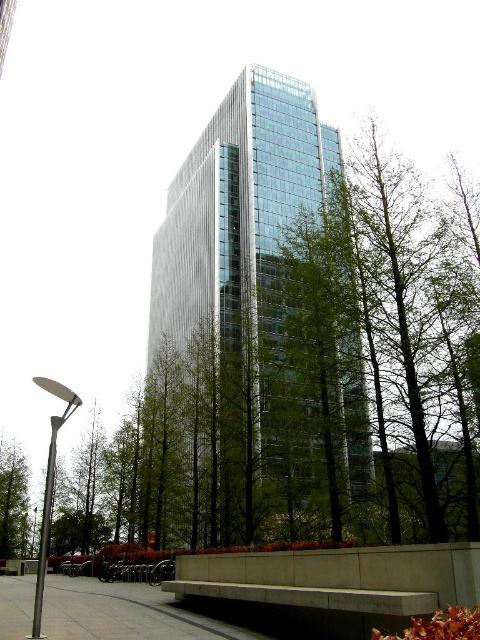
You are standing in front of the modern glass and steel building and see two points marked on the ground. The first point is at coordinate point (x=213, y=140) and the second is at point (x=4, y=451). Which point is closer to you?

Point (x=213, y=140) is closer to you because it is further to the viewer than point (x=4, y=451).

You are a city planner assessing the urban layout. Given the glassy metallic skyscraper at center and the concrete pavement at lower center, which object occupies a greater vertical space in the image?

The glassy metallic skyscraper at center is much taller than the concrete pavement at lower center, so it occupies a greater vertical space in the image.